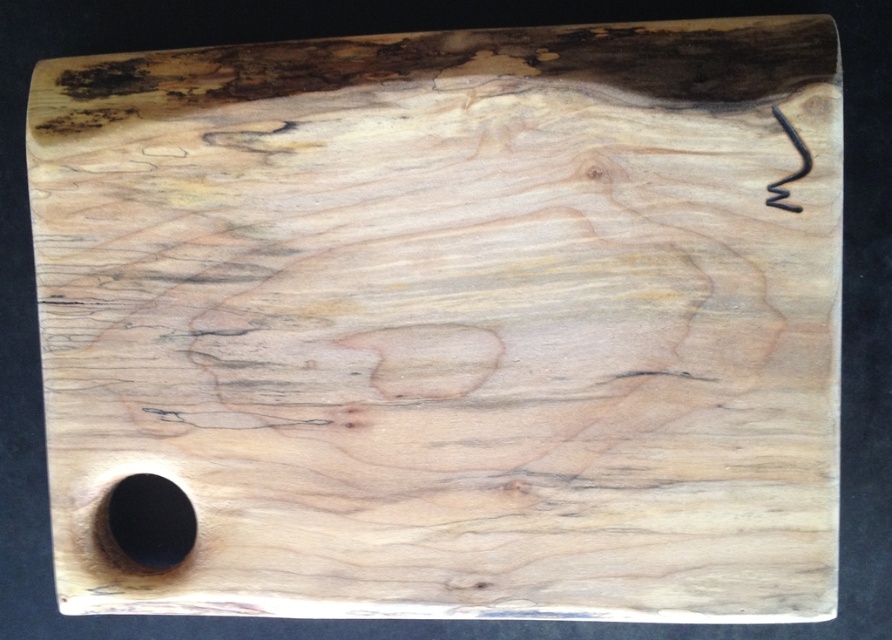
You are hanging a picture frame that weighs 2 kilograms. You have two options on the wood panel to attach it to. The options are the black matte hole at bottom left and the matte black hook at upper right. Based on their sizes, which one is more suitable for holding the weight?

The black matte hole at bottom left has a larger size compared to the matte black hook at upper right, so it is more suitable for holding the weight of the picture frame since larger holes can support heavier items better.